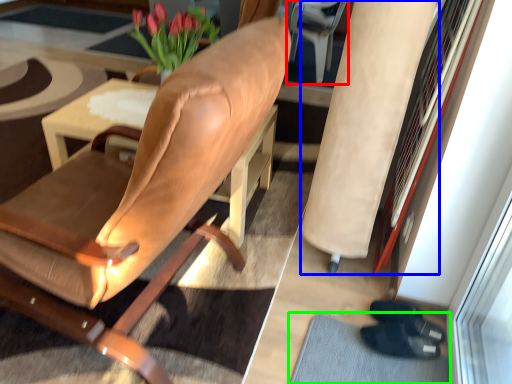
Question: Which object is positioned farthest from armchair (highlighted by a red box)? Select from beige (highlighted by a blue box) and doormat (highlighted by a green box).

Choices:
 (A) beige
 (B) doormat

Answer: (B)